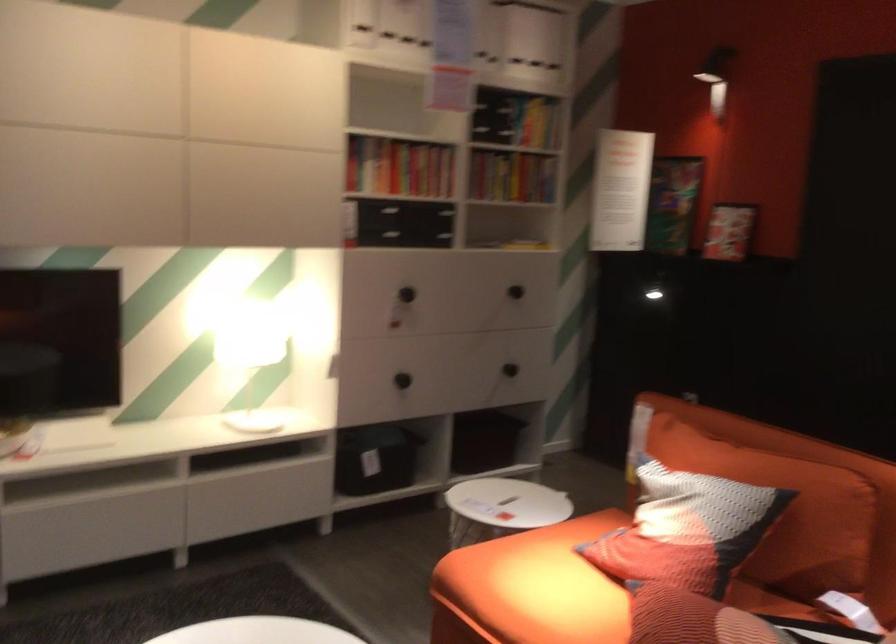
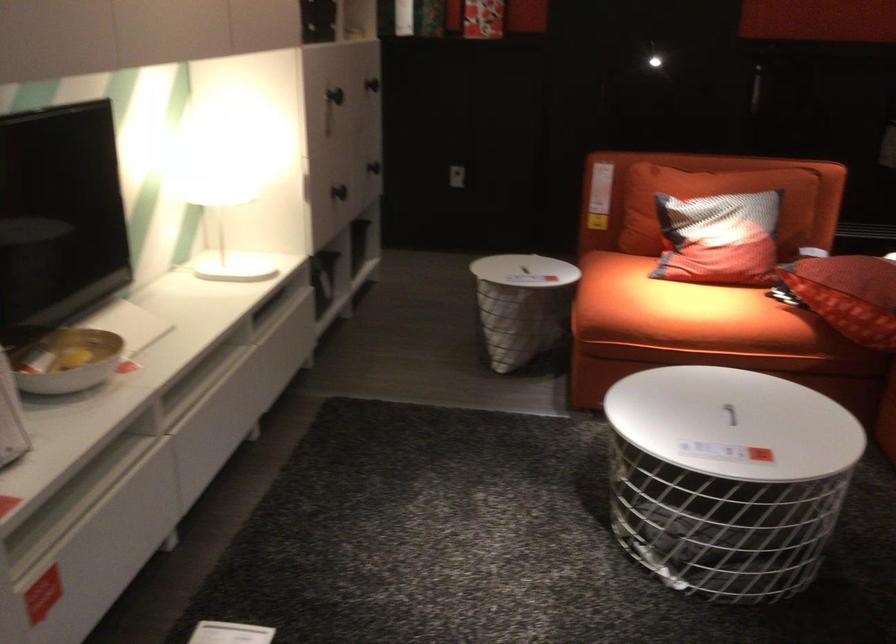
Find the pixel in the second image that matches (236,348) in the first image.

(199, 198)